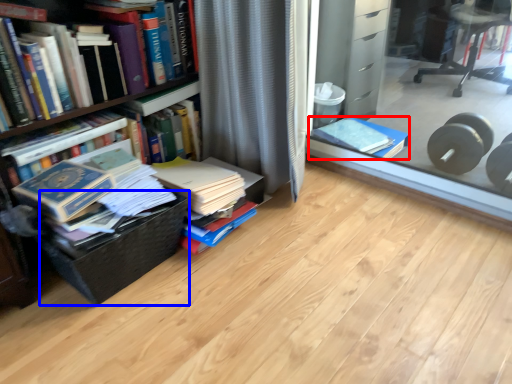
Question: Which of the following is the closest to the observer, book (highlighted by a red box) or basket (highlighted by a blue box)?

Choices:
 (A) book
 (B) basket

Answer: (B)